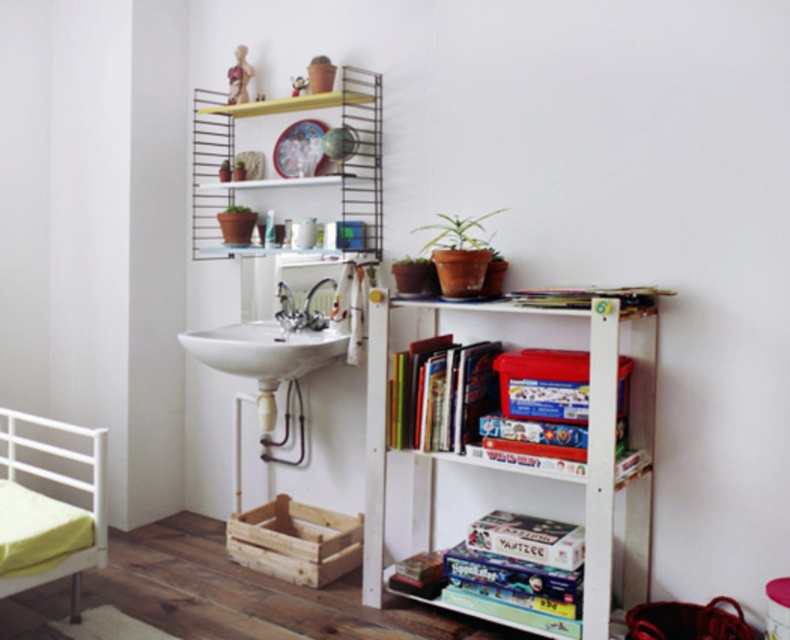
You are trying to reach the hardcover book at upper center but there is a white glossy faucet at upper center in the way. Can you move the book without touching the faucet?

The hardcover book at upper center is positioned under the white glossy faucet at upper center, so you can move the book without touching the faucet by lifting it from below.

You are arranging items on the shelves above the sink. You have a silver metallic faucet at center and a matte plastic toy at upper center. Which item should you place to the right of the other?

The silver metallic faucet at center should be placed to the left of the matte plastic toy at upper center because the silver metallic faucet at center is positioned on the left side of matte plastic toy at upper center.

You are standing in the room and want to reach the white wooden bookshelf at right to retrieve a book. Considering your arm can extend 2.5 feet, can you reach the bookshelf without moving closer?

The distance between you and the white wooden bookshelf at right is 7.15 feet, which is greater than your arm extension of 2.5 feet. Therefore, you cannot reach the bookshelf without moving closer.